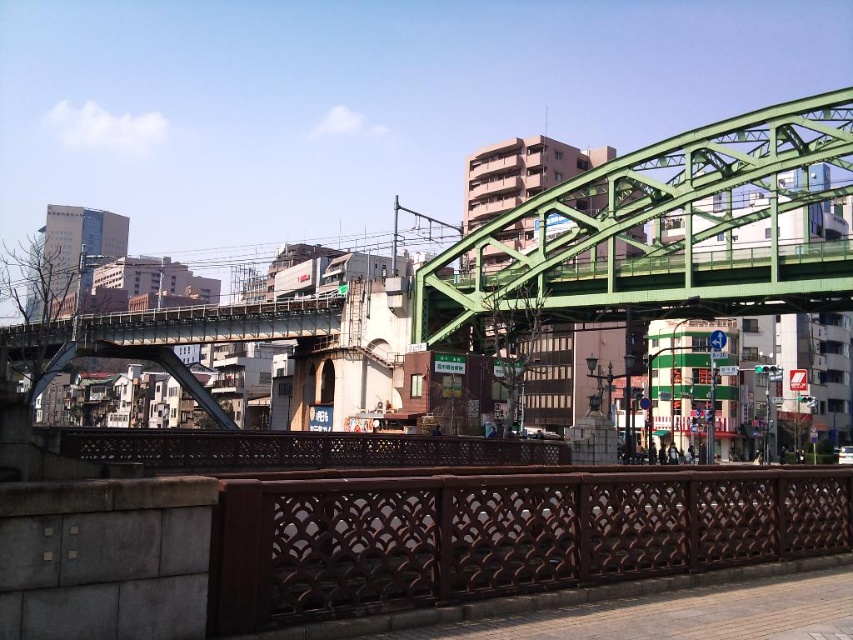
Question: Based on their relative distances, which object is farther from the brown textured rail at lower center?

Choices:
 (A) brown wooden rail at center
 (B) green metallic bridge at upper center

Answer: (B)

Question: Is brown textured rail at lower center thinner than brown wooden rail at center?

Choices:
 (A) no
 (B) yes

Answer: (B)

Question: Does brown textured rail at lower center have a greater width compared to brown wooden rail at center?

Choices:
 (A) yes
 (B) no

Answer: (B)

Question: Which of the following is the closest to the observer?

Choices:
 (A) (473, 524)
 (B) (154, 468)

Answer: (A)

Question: Which of the following is the closest to the observer?

Choices:
 (A) brown wooden rail at center
 (B) brown textured rail at lower center

Answer: (B)

Question: Does brown textured rail at lower center have a smaller size compared to green metallic bridge at upper center?

Choices:
 (A) yes
 (B) no

Answer: (A)